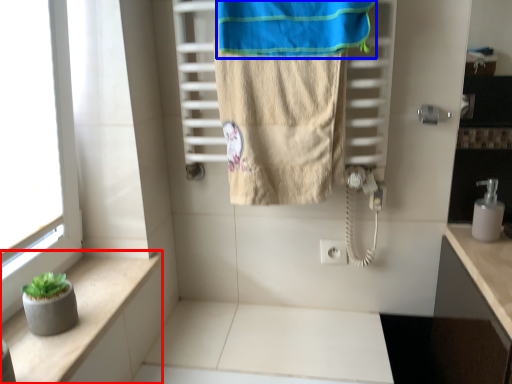
Question: Which point is further to the camera, balustrade (highlighted by a red box) or beach towel (highlighted by a blue box)?

Choices:
 (A) balustrade
 (B) beach towel

Answer: (B)